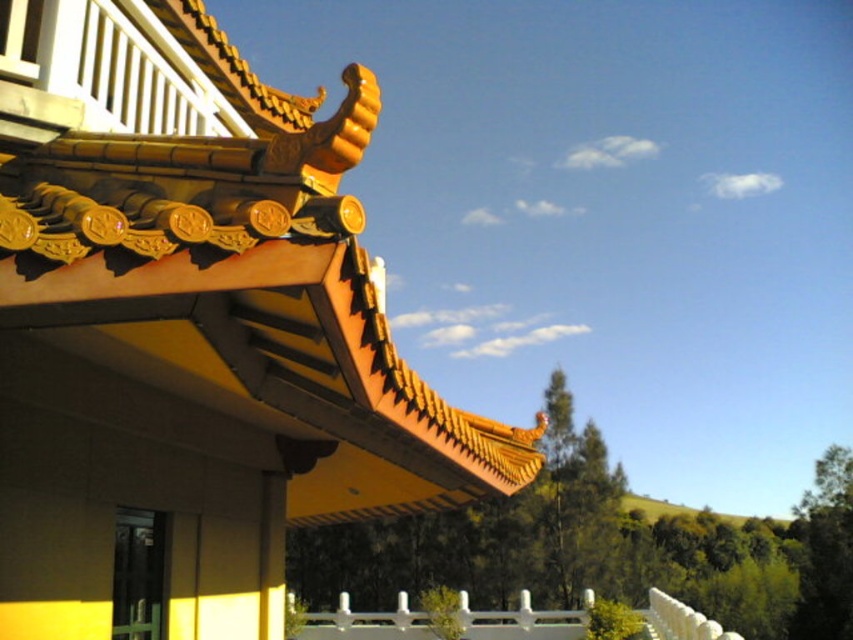
Question: Does golden glazed tiles at upper left appear on the left side of white glossy fence at lower center?

Choices:
 (A) no
 (B) yes

Answer: (B)

Question: Which point appears farthest from the camera in this image?

Choices:
 (A) (573, 636)
 (B) (250, 72)

Answer: (A)

Question: Does golden glazed tiles at upper left appear over white glossy fence at lower center?

Choices:
 (A) no
 (B) yes

Answer: (B)

Question: Is golden glazed tiles at upper left wider than white glossy fence at lower center?

Choices:
 (A) yes
 (B) no

Answer: (B)